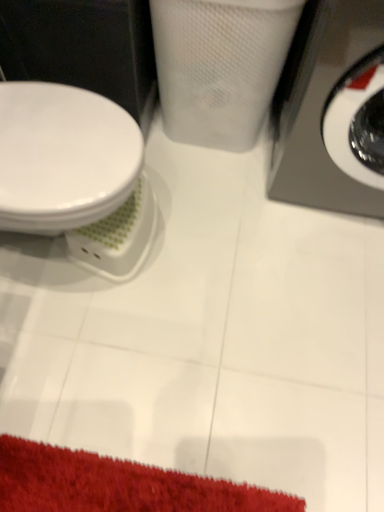
Question: From the image's perspective, is white glossy toilet at left above or below metallic gray washing machine at right?

Choices:
 (A) above
 (B) below

Answer: (B)

Question: Is white glossy toilet at left inside the boundaries of metallic gray washing machine at right, or outside?

Choices:
 (A) inside
 (B) outside

Answer: (B)

Question: Is white glossy toilet at left wider or thinner than metallic gray washing machine at right?

Choices:
 (A) thin
 (B) wide

Answer: (A)

Question: Is metallic gray washing machine at right wider or thinner than white glossy toilet at left?

Choices:
 (A) thin
 (B) wide

Answer: (B)

Question: Considering the relative positions of metallic gray washing machine at right and white glossy toilet at left in the image provided, is metallic gray washing machine at right to the left or to the right of white glossy toilet at left?

Choices:
 (A) right
 (B) left

Answer: (A)

Question: From the image's perspective, relative to white glossy toilet at left, is metallic gray washing machine at right above or below?

Choices:
 (A) below
 (B) above

Answer: (B)

Question: From a real-world perspective, is metallic gray washing machine at right physically located above or below white glossy toilet at left?

Choices:
 (A) below
 (B) above

Answer: (B)